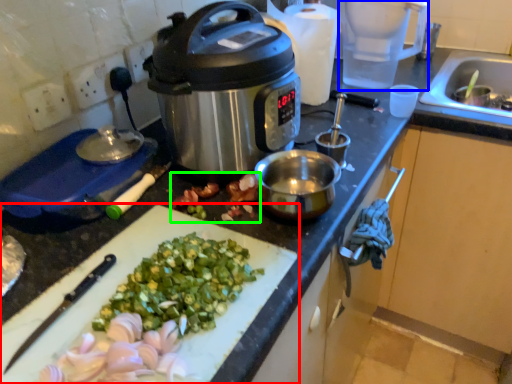
Question: Estimate the real-world distances between objects in this image. Which object is closer to cutting board (highlighted by a red box), blender (highlighted by a blue box) or produce (highlighted by a green box)?

Choices:
 (A) blender
 (B) produce

Answer: (B)